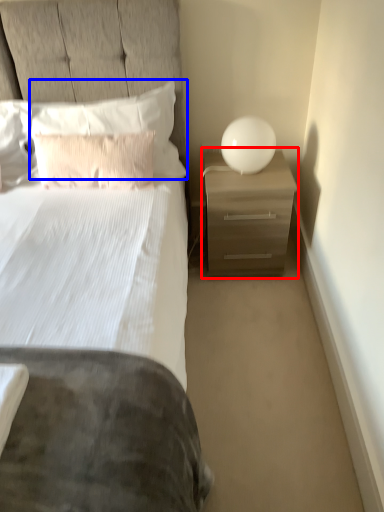
Question: Which of the following is the closest to the observer, nightstand (highlighted by a red box) or pillow (highlighted by a blue box)?

Choices:
 (A) nightstand
 (B) pillow

Answer: (B)